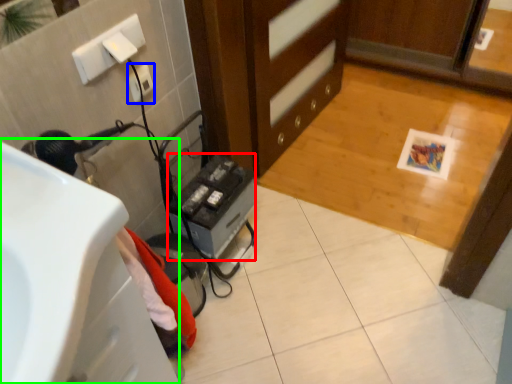
Question: Based on their relative distances, which object is farther from appliance (highlighted by a red box)? Choose from electric outlet (highlighted by a blue box) and sink (highlighted by a green box).

Choices:
 (A) electric outlet
 (B) sink

Answer: (B)